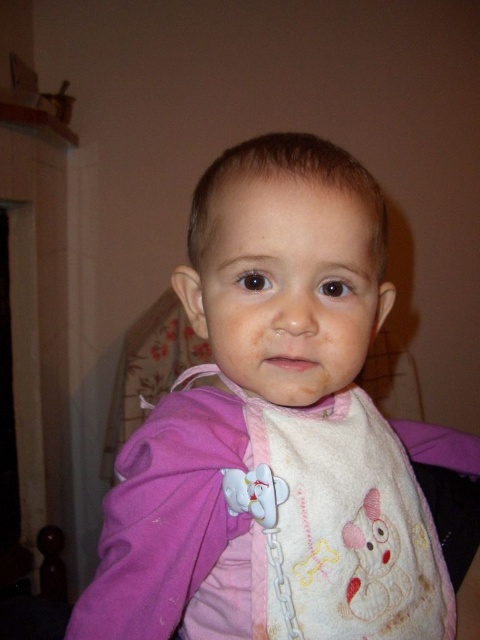
Can you confirm if pink fabric bib at center is bigger than white fabric bib at center?

Yes.

Between point (321, 388) and point (359, 435), which one is positioned in front?

Point (321, 388) is in front.

Measure the distance between point (193, 589) and camera.

A distance of 16.94 inches exists between point (193, 589) and camera.

Where is `pink fabric bib at center`? The image size is (480, 640). pink fabric bib at center is located at coordinates (276, 433).